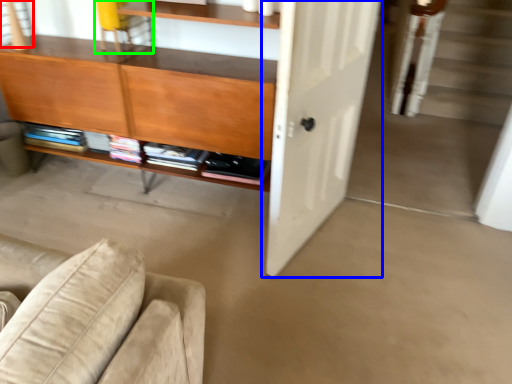
Question: Based on their relative distances, which object is farther from window (highlighted by a red box)? Choose from door (highlighted by a blue box) and chair (highlighted by a green box).

Choices:
 (A) door
 (B) chair

Answer: (A)